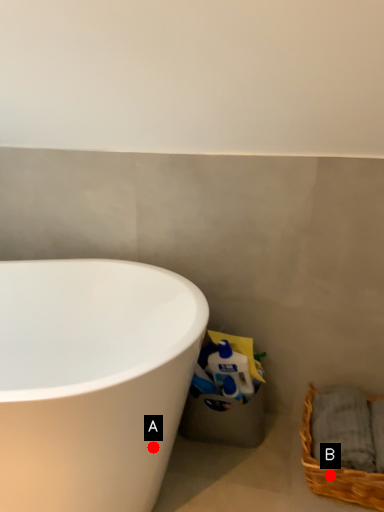
Question: Two points are circled on the image, labeled by A and B beside each circle. Which point is closer to the camera taking this photo?

Choices:
 (A) A is closer
 (B) B is closer

Answer: (A)